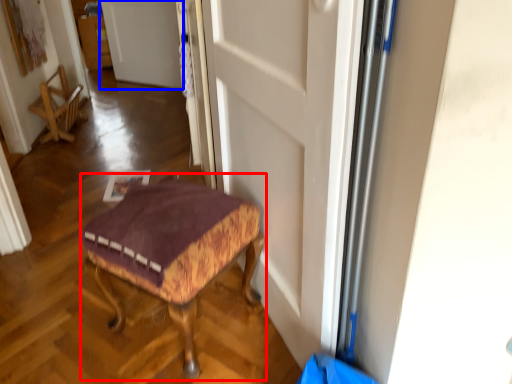
Question: Which of the following is the farthest to the observer, furniture (highlighted by a red box) or door (highlighted by a blue box)?

Choices:
 (A) furniture
 (B) door

Answer: (B)